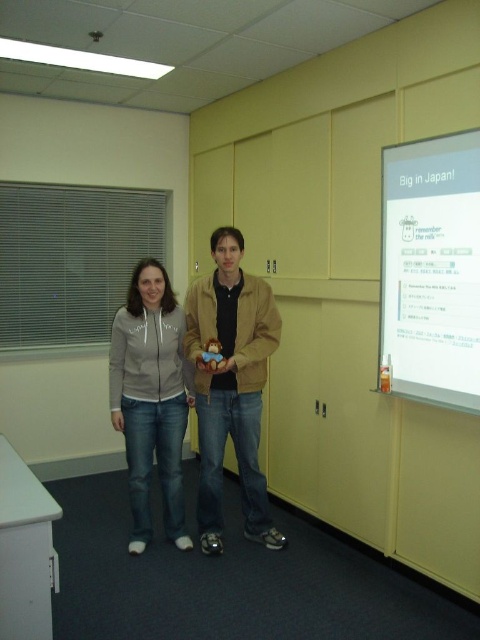
You are setting up for a presentation and need to place a laptop on the white matte projection screen at upper right and the matte beige hoodie at center. Which object is smaller and thus more suitable for placing the laptop?

The white matte projection screen at upper right is smaller than the matte beige hoodie at center, so it is more suitable for placing the laptop.

You are setting up a presentation in the conference room and need to ensure the white matte projection screen at upper right is visible to everyone. Considering the height of the matte beige hoodie at center, which is taller, will the screen be visible to someone sitting at the back of the room?

The white matte projection screen at upper right is shorter than the matte beige hoodie at center. Since the screen is shorter than the hoodie, it might not be visible to someone sitting at the back of the room if the hoodie is blocking the view.